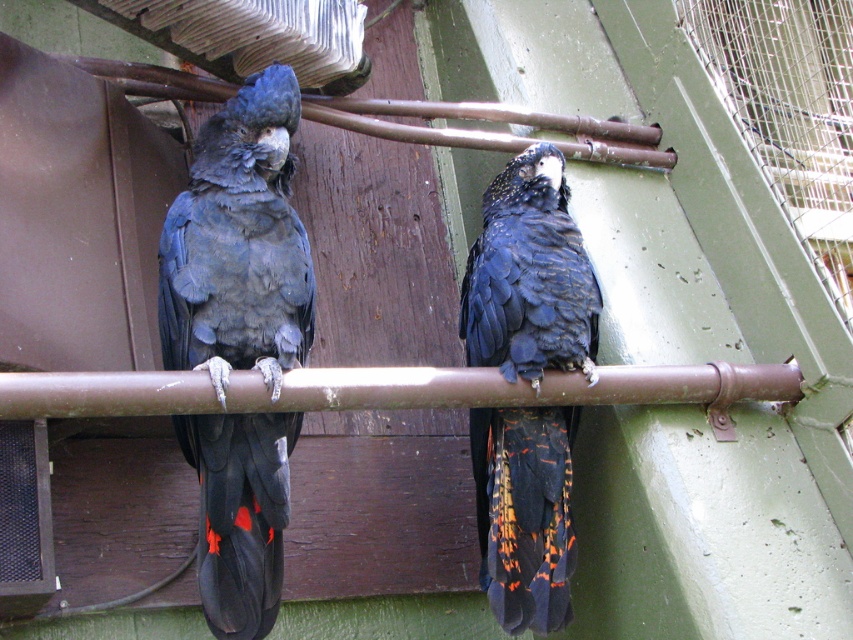
Question: Does matte black parrot at left appear on the left side of black glossy feathers at center?

Choices:
 (A) yes
 (B) no

Answer: (A)

Question: Can you confirm if matte black parrot at left is thinner than black glossy feathers at center?

Choices:
 (A) no
 (B) yes

Answer: (A)

Question: Among these objects, which one is nearest to the camera?

Choices:
 (A) matte black parrot at left
 (B) black glossy feathers at center

Answer: (A)

Question: Is matte black parrot at left smaller than black glossy feathers at center?

Choices:
 (A) no
 (B) yes

Answer: (B)

Question: Which of the following is the closest to the observer?

Choices:
 (A) (183, 358)
 (B) (505, 371)

Answer: (A)